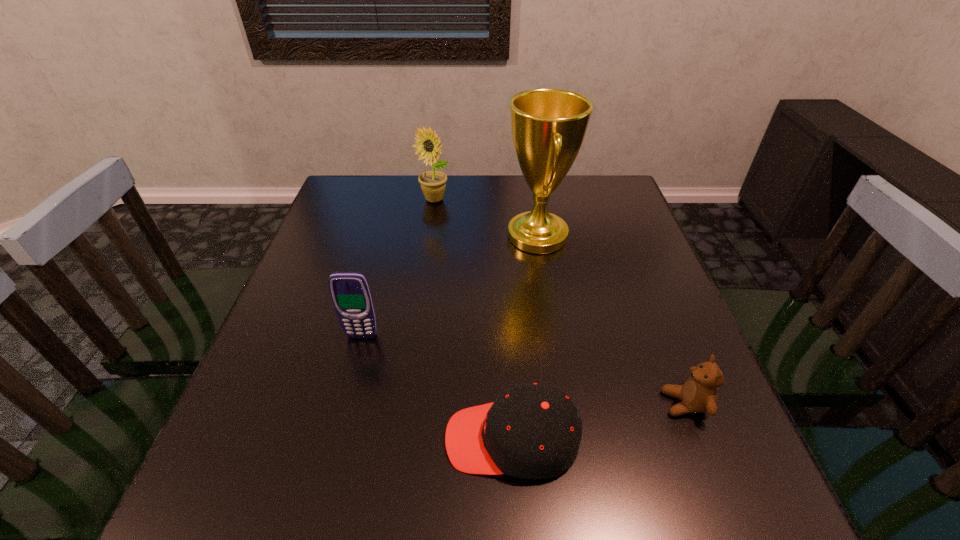
Locate an element on the screen. The image size is (960, 540). object located in the near edge section of the desktop is located at coordinates (531, 431).

Locate an element on the screen. The image size is (960, 540). object situated at the left edge is located at coordinates (350, 292).

At what (x,y) coordinates should I click in order to perform the action: click on object at the right edge. Please return your answer as a coordinate pair (x, y). The height and width of the screenshot is (540, 960). Looking at the image, I should click on (698, 394).

In the image, there is a desktop. What are the coordinates of `free space at the far edge` in the screenshot? It's located at (419, 207).

Where is `free space at the near edge of the desktop`? This screenshot has height=540, width=960. free space at the near edge of the desktop is located at coordinates (320, 525).

This screenshot has height=540, width=960. In the image, there is a desktop. In order to click on blank space at the left edge in this screenshot , I will do `click(310, 401)`.

Image resolution: width=960 pixels, height=540 pixels. In the image, there is a desktop. Find the location of `vacant space at the right edge`. vacant space at the right edge is located at coordinates pos(652,288).

Find the location of a particular element. vacant space at the far left corner of the desktop is located at coordinates (369, 177).

Locate an element on the screen. This screenshot has height=540, width=960. free location at the near left corner is located at coordinates (223, 518).

This screenshot has height=540, width=960. In order to click on vacant space at the far right corner of the desktop in this screenshot , I will do `click(609, 180)`.